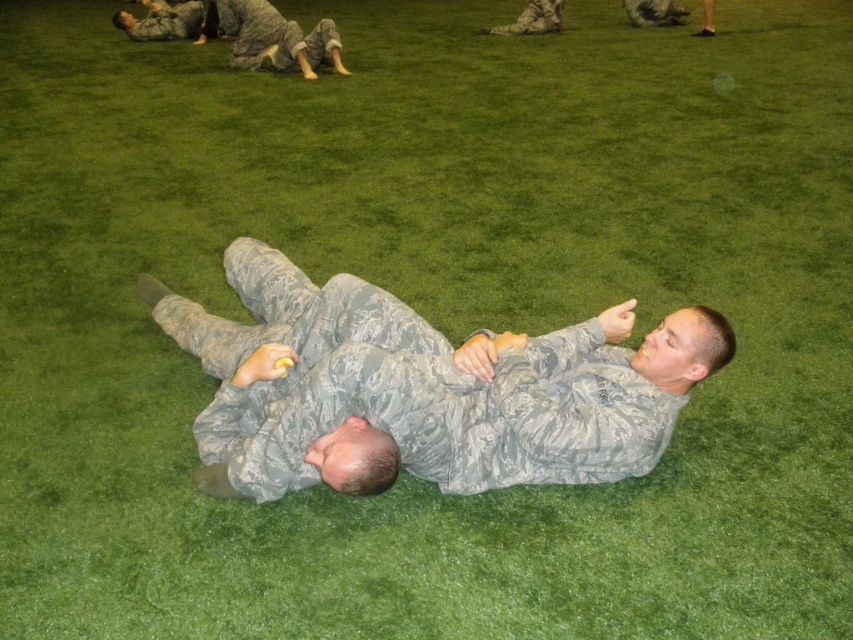
Is camouflage fabric man at upper center taller than camouflage uniform at upper left?

Indeed, camouflage fabric man at upper center has a greater height compared to camouflage uniform at upper left.

Who is more forward, (279, 24) or (202, 3)?

Positioned in front is point (279, 24).

Find the location of a particular element. This screenshot has height=640, width=853. camouflage fabric man at upper center is located at coordinates (276, 38).

Which is in front, point (131, 33) or point (540, 20)?

Point (131, 33) is more forward.

Is camouflage uniform at upper left positioned in front of camouflage uniform at upper center?

Yes, camouflage uniform at upper left is in front of camouflage uniform at upper center.

You are a GUI agent. You are given a task and a screenshot of the screen. Output one action in this format:
    pyautogui.click(x=<x>, y=<y>)
    Task: Click on the camouflage uniform at upper left
    The image size is (853, 640).
    Given the screenshot: What is the action you would take?
    (x=167, y=20)

Image resolution: width=853 pixels, height=640 pixels. Find the location of `camouflage uniform at upper left`. camouflage uniform at upper left is located at coordinates (167, 20).

Does camouflage fabric man at upper center have a larger size compared to camouflage uniform at upper center?

Correct, camouflage fabric man at upper center is larger in size than camouflage uniform at upper center.

Does point (328, 29) lie behind point (532, 19)?

No.

Is point (256, 33) farther from viewer compared to point (531, 26)?

No, it is in front of (531, 26).

You are a GUI agent. You are given a task and a screenshot of the screen. Output one action in this format:
    pyautogui.click(x=<x>, y=<y>)
    Task: Click on the camouflage fabric man at upper center
    Image resolution: width=853 pixels, height=640 pixels.
    Given the screenshot: What is the action you would take?
    pyautogui.click(x=276, y=38)